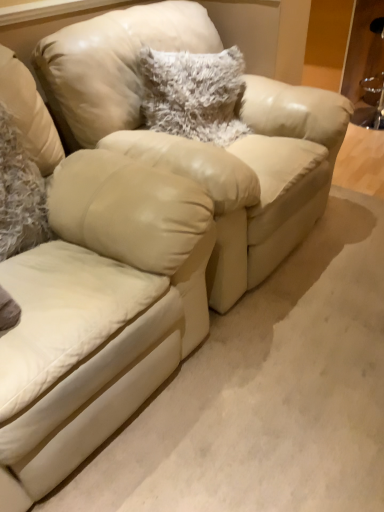
Question: From their relative heights in the image, would you say matte leather swivel chair at center is taller or shorter than fuzzy white pillow at left, which is the 1th pillow in front-to-back order?

Choices:
 (A) short
 (B) tall

Answer: (B)

Question: Does point (132, 161) appear closer or farther from the camera than point (1, 240)?

Choices:
 (A) farther
 (B) closer

Answer: (A)

Question: Based on their relative distances, which object is nearer to the fuzzy white pillow at center, the 1th pillow from the right?

Choices:
 (A) fuzzy white pillow at left, the second pillow from the right
 (B) matte leather swivel chair at center

Answer: (A)

Question: Which object is positioned closest to the fuzzy white pillow at center, positioned as the first pillow in back-to-front order?

Choices:
 (A) fuzzy white pillow at left, which is the second pillow from back to front
 (B) matte leather swivel chair at center

Answer: (A)